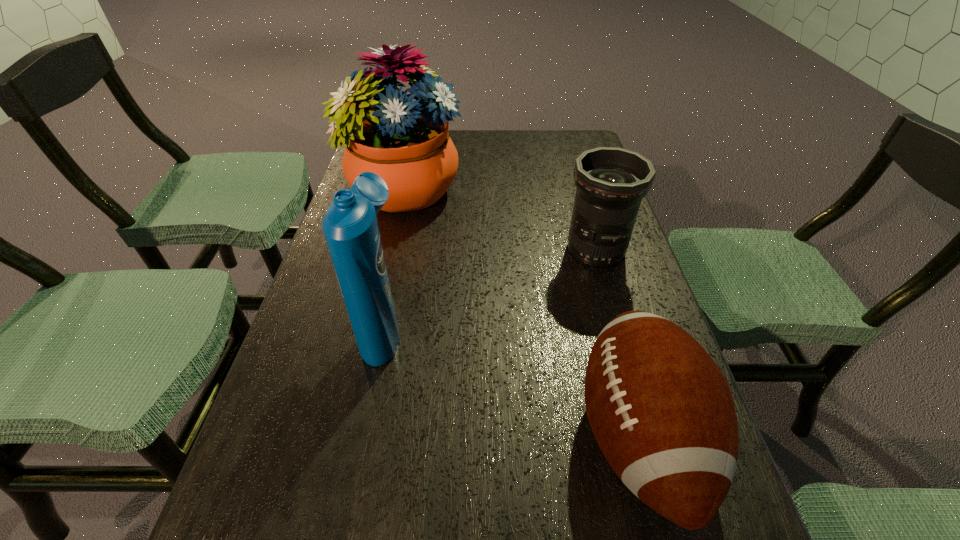
I want to click on object present at the far left corner, so (x=405, y=142).

In the image, there is a desktop. Identify the location of blank space at the far edge. (526, 133).

The width and height of the screenshot is (960, 540). In the image, there is a desktop. What are the coordinates of `vacant space at the left edge` in the screenshot? It's located at (333, 289).

At what (x,y) coordinates should I click in order to perform the action: click on vacant space at the right edge of the desktop. Please return your answer as a coordinate pair (x, y). Looking at the image, I should click on (636, 274).

The height and width of the screenshot is (540, 960). I want to click on free space between the third nearest object and the third shortest object, so click(490, 288).

Where is `vacant space that's between the farthest object and the third shortest object`? This screenshot has width=960, height=540. vacant space that's between the farthest object and the third shortest object is located at coordinates (396, 259).

Where is `vacant area that lies between the flower arrangement and the third shortest object`? The width and height of the screenshot is (960, 540). vacant area that lies between the flower arrangement and the third shortest object is located at coordinates (396, 259).

Locate an element on the screen. unoccupied position between the farthest object and the third shortest object is located at coordinates (396, 259).

Identify which object is the third nearest to the football. Please provide its 2D coordinates. Your answer should be formatted as a tuple, i.e. [(x, y)], where the tuple contains the x and y coordinates of a point satisfying the conditions above.

[(405, 142)]

This screenshot has height=540, width=960. I want to click on object that is the closest to the football, so click(611, 182).